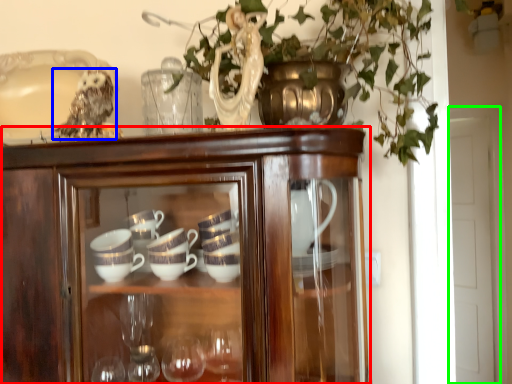
Question: Which object is positioned closest to cupboard (highlighted by a red box)? Select from owl (highlighted by a blue box) and glass door (highlighted by a green box).

Choices:
 (A) owl
 (B) glass door

Answer: (A)